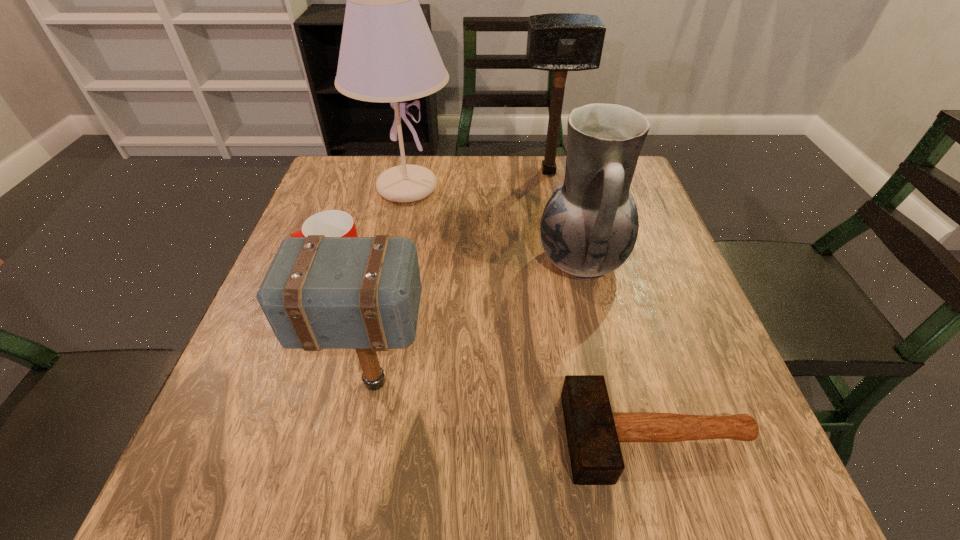
Where is `lampshade`? lampshade is located at coordinates (387, 54).

Identify the location of the tallest mallet. The image size is (960, 540). (560, 42).

Where is `pitcher`? The width and height of the screenshot is (960, 540). pitcher is located at coordinates (589, 227).

Locate an element on the screen. the leftmost mallet is located at coordinates click(x=363, y=293).

Find the location of a particular element. the second tallest mallet is located at coordinates click(363, 293).

What are the coordinates of `cup` in the screenshot? It's located at (332, 223).

What are the coordinates of `the shortest object` in the screenshot? It's located at (593, 432).

Locate an element on the screen. vacant space located on the front of the lampshade is located at coordinates (374, 346).

Where is `vacant space situated 0.290m on the front of the farthest mallet`? vacant space situated 0.290m on the front of the farthest mallet is located at coordinates (564, 251).

The height and width of the screenshot is (540, 960). I want to click on vacant region located on the front-facing side of the pitcher, so click(x=372, y=261).